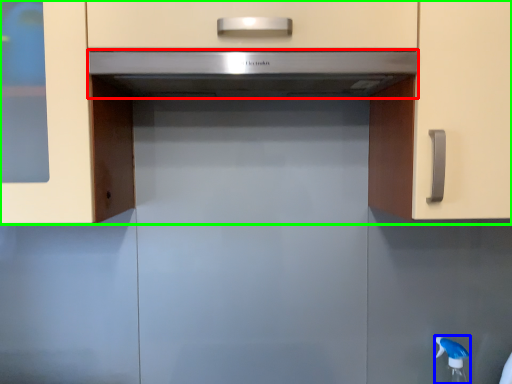
Question: Estimate the real-world distances between objects in this image. Which object is closer to home appliance (highlighted by a red box), faucet (highlighted by a blue box) or cabinetry (highlighted by a green box)?

Choices:
 (A) faucet
 (B) cabinetry

Answer: (B)